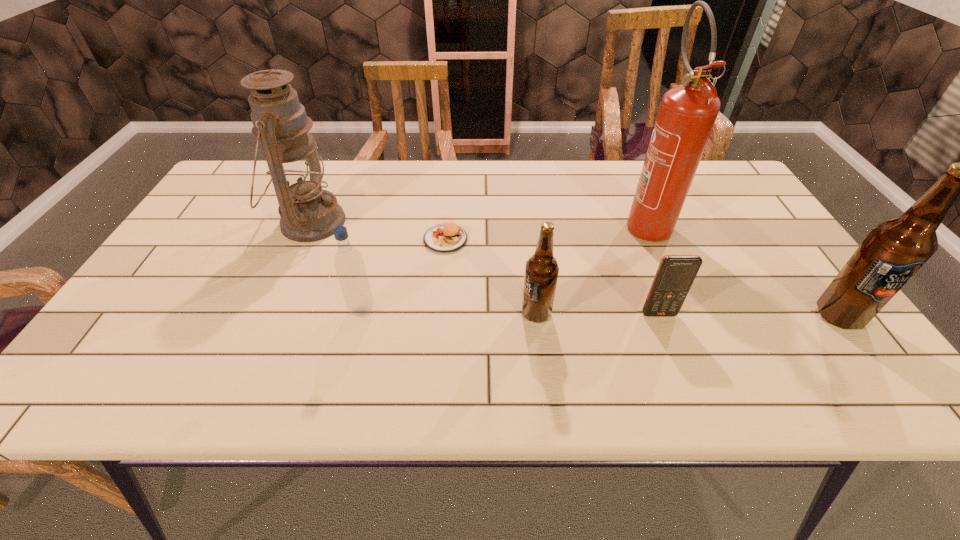
Where is `vacant area that lies between the fire extinguisher and the shorter beer bottle`? This screenshot has height=540, width=960. vacant area that lies between the fire extinguisher and the shorter beer bottle is located at coordinates (590, 268).

Where is `vacant space that's between the rightmost object and the oil lamp`? vacant space that's between the rightmost object and the oil lamp is located at coordinates (574, 269).

At what (x,y) coordinates should I click in order to perform the action: click on vacant region between the taller beer bottle and the water bottle. Please return your answer as a coordinate pair (x, y). Looking at the image, I should click on (601, 313).

In order to click on free area in between the leftmost object and the tallest object in this screenshot , I will do `click(478, 222)`.

At what (x,y) coordinates should I click in order to perform the action: click on vacant area between the cellular telephone and the shorter beer bottle. Please return your answer as a coordinate pair (x, y). The image size is (960, 540). Looking at the image, I should click on (597, 314).

Locate an element on the screen. The height and width of the screenshot is (540, 960). vacant point located between the third object from left to right and the left beer bottle is located at coordinates (491, 276).

Locate an element on the screen. The width and height of the screenshot is (960, 540). vacant area between the cellular telephone and the right beer bottle is located at coordinates (749, 315).

Locate an element on the screen. Image resolution: width=960 pixels, height=540 pixels. object that stands as the second closest to the second object from left to right is located at coordinates (443, 238).

I want to click on object that is the third nearest to the taller beer bottle, so click(x=541, y=272).

Find the location of a particular element. The height and width of the screenshot is (540, 960). free space in the image that satisfies the following two spatial constraints: 1. from the nozzle of the fire extinguisher; 2. on the label of the left beer bottle is located at coordinates (685, 314).